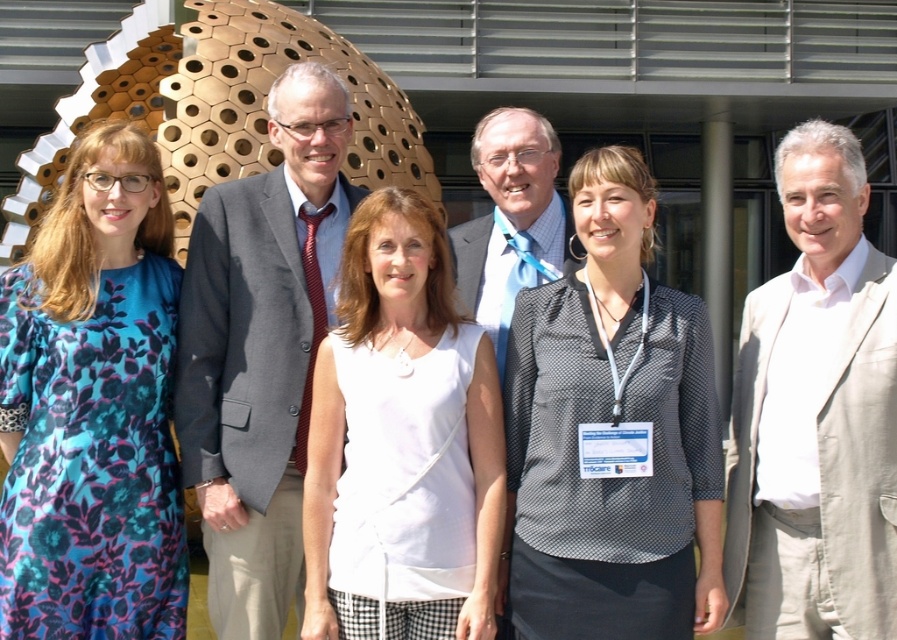
Question: Which object is the farthest from the polka dot blouse at center?

Choices:
 (A) white fabric shirt at center
 (B) light beige suit at center

Answer: (A)

Question: Which object is closer to the camera taking this photo?

Choices:
 (A) blue floral dress at left
 (B) light beige suit at center

Answer: (B)

Question: Is blue floral dress at left behind light blue fabric at center?

Choices:
 (A) no
 (B) yes

Answer: (A)

Question: Which of the following is the closest to the observer?

Choices:
 (A) polka dot blouse at center
 (B) light blue fabric at center

Answer: (A)

Question: Where is blue floral dress at left located in relation to light blue fabric at center in the image?

Choices:
 (A) above
 (B) below

Answer: (B)

Question: Can you confirm if polka dot blouse at center is wider than light blue fabric at center?

Choices:
 (A) yes
 (B) no

Answer: (A)